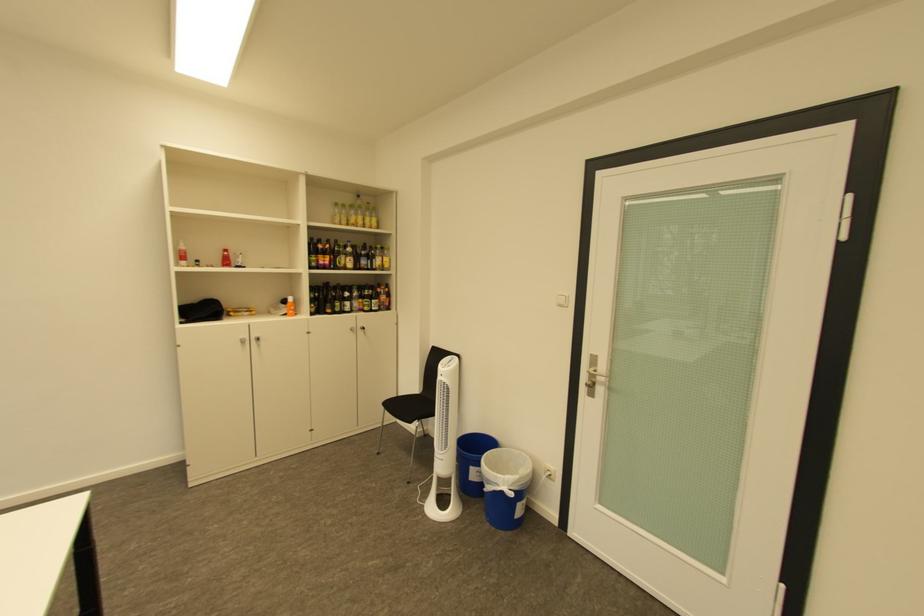
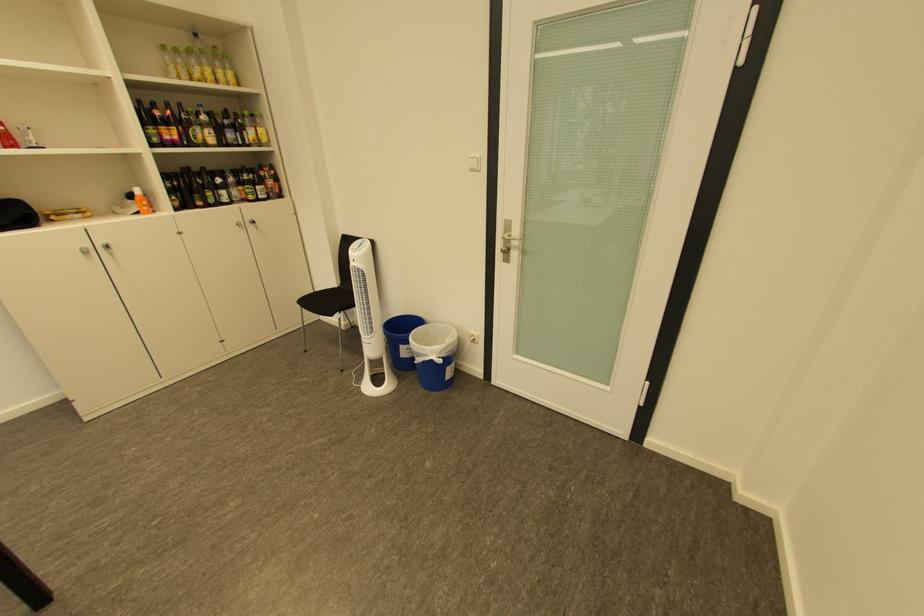
The point at (295, 315) is marked in the first image. Where is the corresponding point in the second image?

(148, 214)